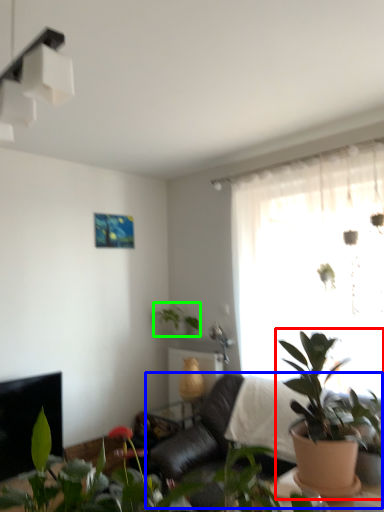
Question: Which is nearer to the houseplant (highlighted by a red box)? couch (highlighted by a blue box) or houseplant (highlighted by a green box).

Choices:
 (A) couch
 (B) houseplant

Answer: (A)